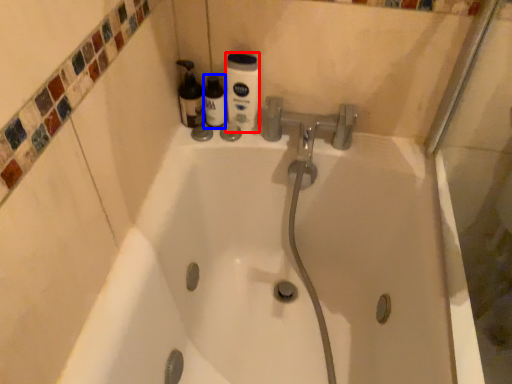
Question: Which object is further to the camera taking this photo, cleaning product (highlighted by a red box) or bottle (highlighted by a blue box)?

Choices:
 (A) cleaning product
 (B) bottle

Answer: (B)